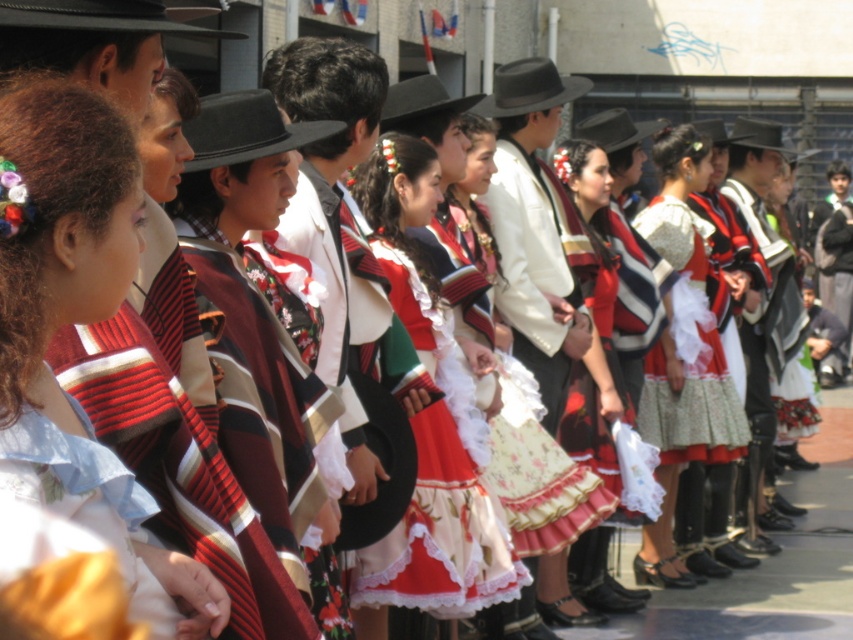
Question: Is floral lace dress at center to the left of floral cotton dress at center from the viewer's perspective?

Choices:
 (A) no
 (B) yes

Answer: (B)

Question: Which of these objects is positioned farthest from the floral cotton dress at center?

Choices:
 (A) matte striped dress at center
 (B) matte red skirt at center
 (C) floral lace dress at center

Answer: (A)

Question: Is floral cotton dress at center to the left of matte red skirt at center from the viewer's perspective?

Choices:
 (A) no
 (B) yes

Answer: (A)

Question: Is matte striped dress at center bigger than floral cotton dress at center?

Choices:
 (A) no
 (B) yes

Answer: (A)

Question: Among these points, which one is farthest from the camera?

Choices:
 (A) (611, 419)
 (B) (697, 173)
 (C) (102, 164)
 (D) (368, 173)

Answer: (B)

Question: Which object appears closest to the camera in this image?

Choices:
 (A) floral cotton dress at center
 (B) matte striped dress at center

Answer: (B)